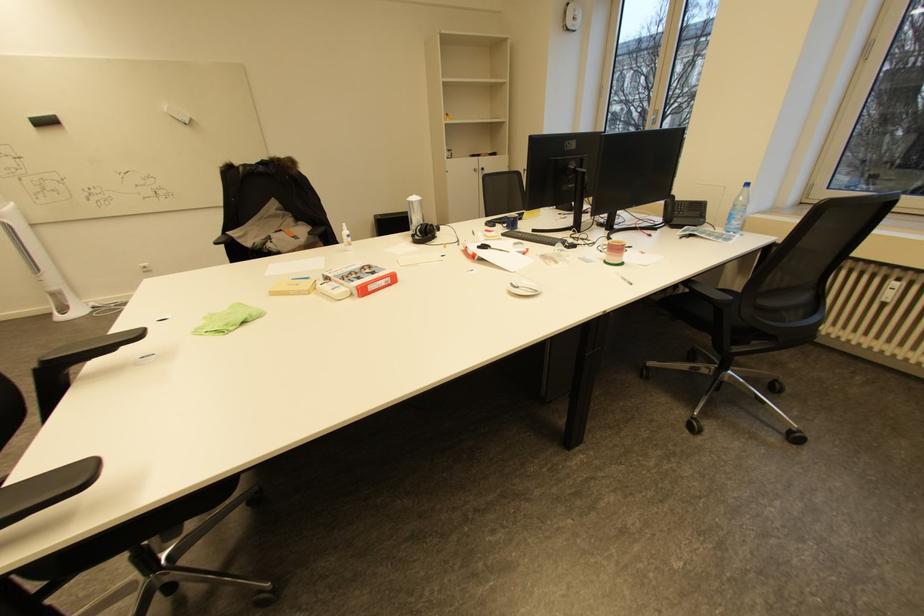
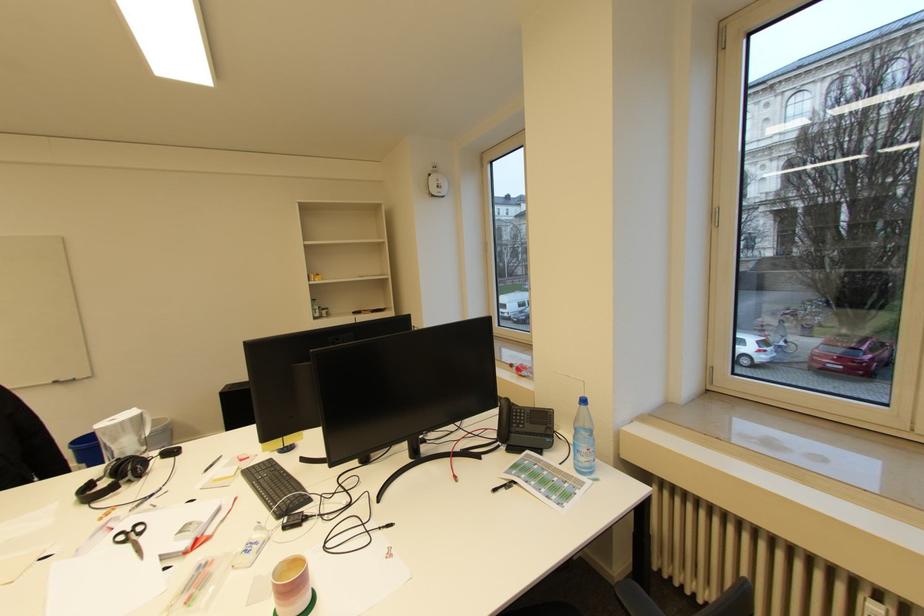
Where in the second image is the point corresponding to pixel 739 206 from the first image?

(581, 429)